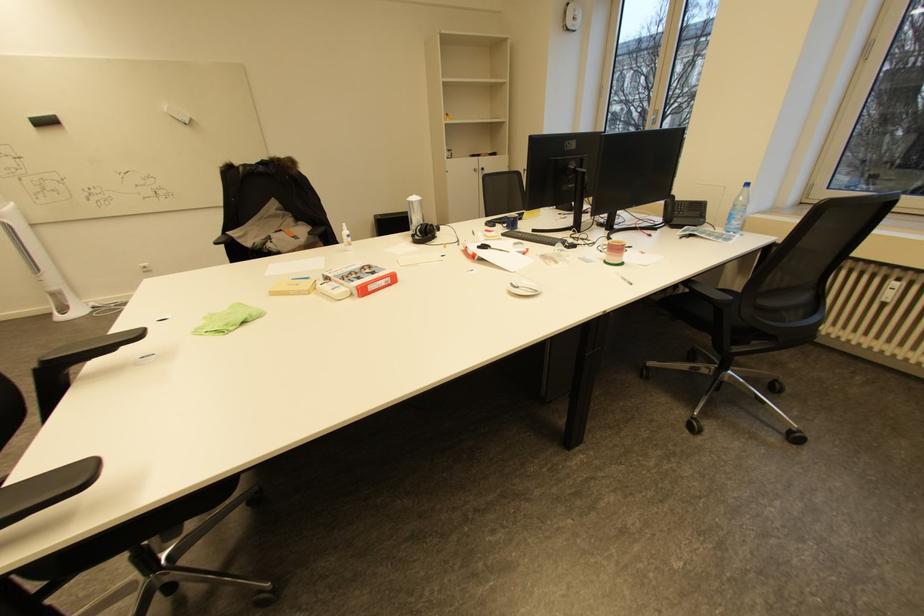
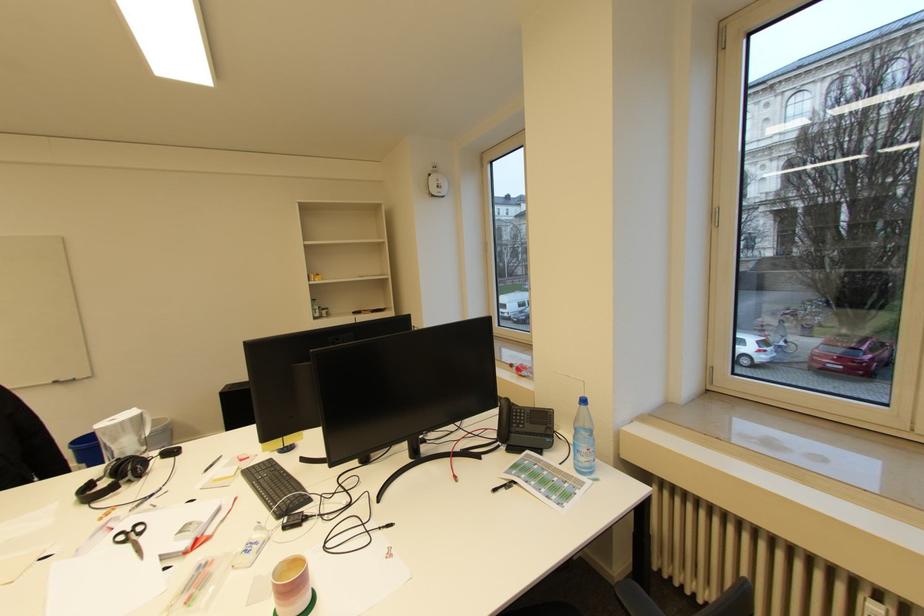
Where in the second image is the point corresponding to pixel 739 206 from the first image?

(581, 429)